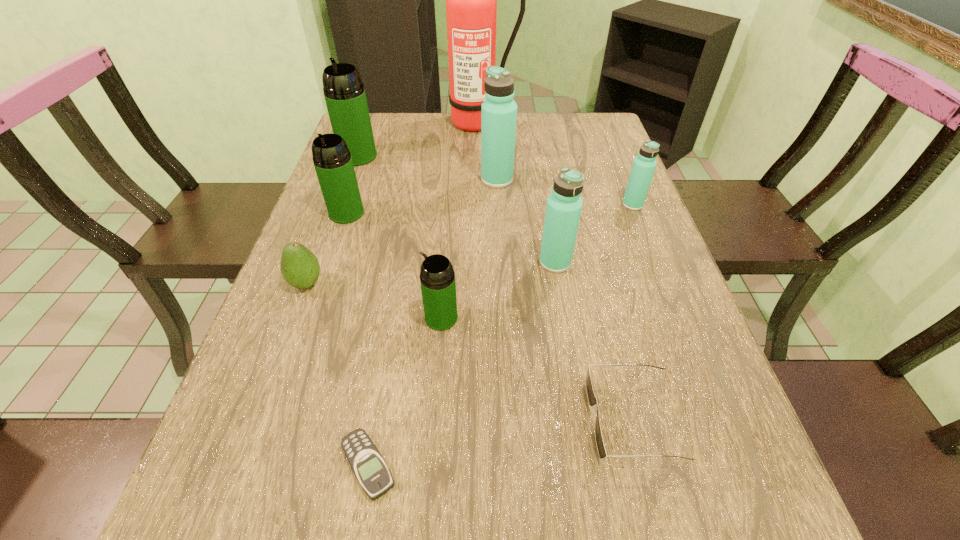
This screenshot has width=960, height=540. I want to click on vacant space located on the back of the gray beeper, so click(x=390, y=342).

This screenshot has height=540, width=960. Identify the location of fire extinguisher that is at the far edge. (471, 0).

Identify the location of thermos bottle located in the far edge section of the desktop. The height and width of the screenshot is (540, 960). (344, 92).

The width and height of the screenshot is (960, 540). I want to click on avocado that is at the left edge, so click(x=300, y=268).

Where is `thermos bottle that is at the right edge`? thermos bottle that is at the right edge is located at coordinates (644, 165).

Identify the location of sunglasses at the right edge. The width and height of the screenshot is (960, 540). (592, 400).

Where is `object that is at the far left corner`? This screenshot has width=960, height=540. object that is at the far left corner is located at coordinates (344, 92).

Locate an element on the screen. blank space at the far edge of the desktop is located at coordinates (420, 136).

The height and width of the screenshot is (540, 960). Identify the location of vacant point at the near edge. (500, 523).

Locate an element on the screen. The image size is (960, 540). free space at the left edge of the desktop is located at coordinates (326, 321).